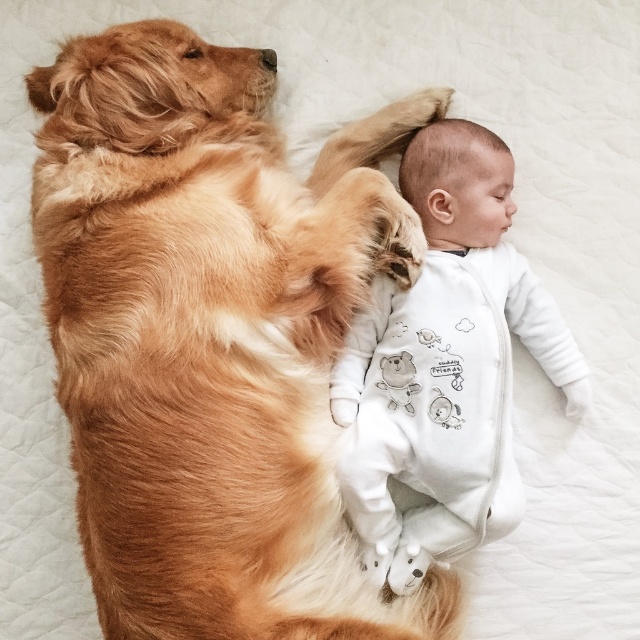
Question: Can you confirm if golden fur dog at upper left is positioned below white soft onesie at center?

Choices:
 (A) no
 (B) yes

Answer: (A)

Question: Does golden fur dog at upper left lie in front of white soft onesie at center?

Choices:
 (A) no
 (B) yes

Answer: (B)

Question: Does golden fur dog at upper left have a larger size compared to white soft onesie at center?

Choices:
 (A) no
 (B) yes

Answer: (B)

Question: Which point is farther to the camera?

Choices:
 (A) golden fur dog at upper left
 (B) white soft onesie at center

Answer: (B)